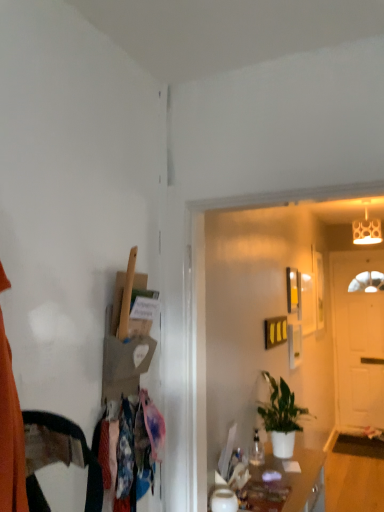
Question: Choose the correct answer: Is white matte door at right inside matte white cabinet at lower center or outside it?

Choices:
 (A) inside
 (B) outside

Answer: (B)

Question: From the image's perspective, is white matte door at right located above or below matte white cabinet at lower center?

Choices:
 (A) above
 (B) below

Answer: (A)

Question: Estimate the real-world distances between objects in this image. Which object is closer to the green matte plant at center?

Choices:
 (A) matte white lampshade at upper right
 (B) floral fabric dress at left
 (C) wooden picture frame at upper right
 (D) matte white cabinet at lower center
 (E) white matte door at right

Answer: (D)

Question: Which object is the closest to the matte white cabinet at lower center?

Choices:
 (A) white matte door at right
 (B) green matte plant at center
 (C) floral fabric dress at left
 (D) wooden picture frame at upper right
 (E) matte white lampshade at upper right

Answer: (B)